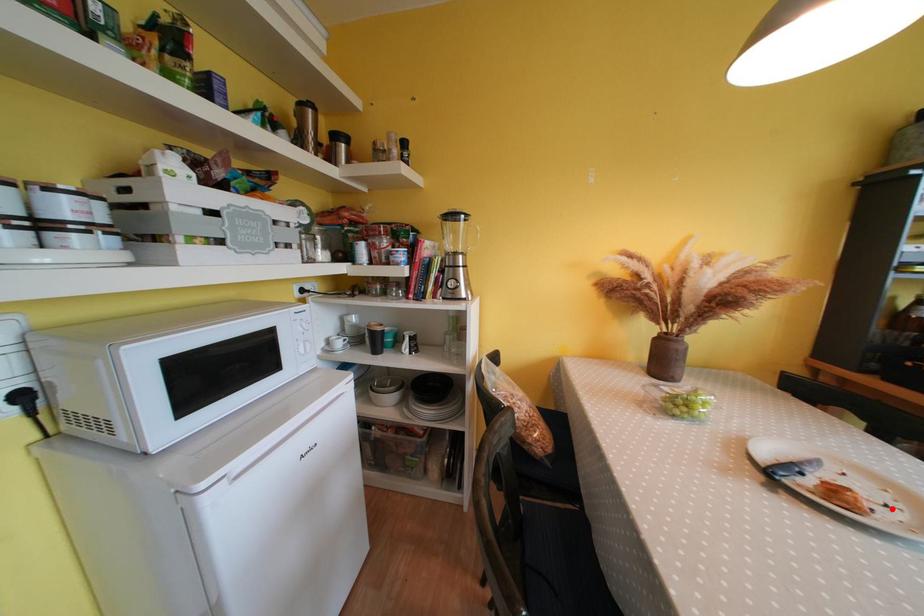
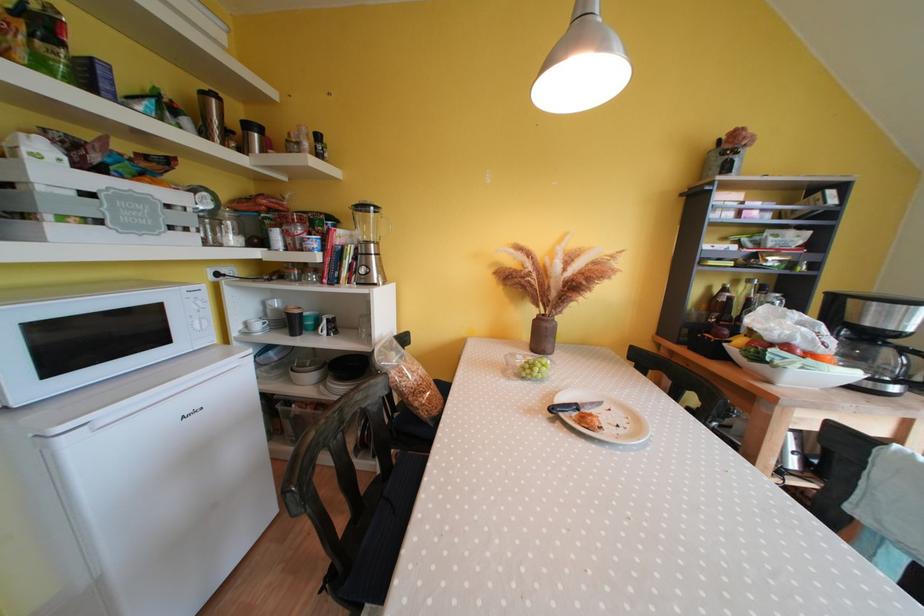
Question: I am providing you with two images of the same scene from different viewpoints. In image1, a red point is highlighted. Considering the same 3D point in image2, which of the following is correct?

Choices:
 (A) It is closer
 (B) It is farther

Answer: (B)